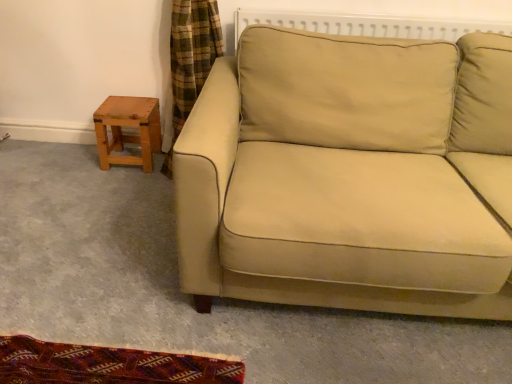
I want to click on vacant region to the left of beige fabric couch at center, so click(95, 240).